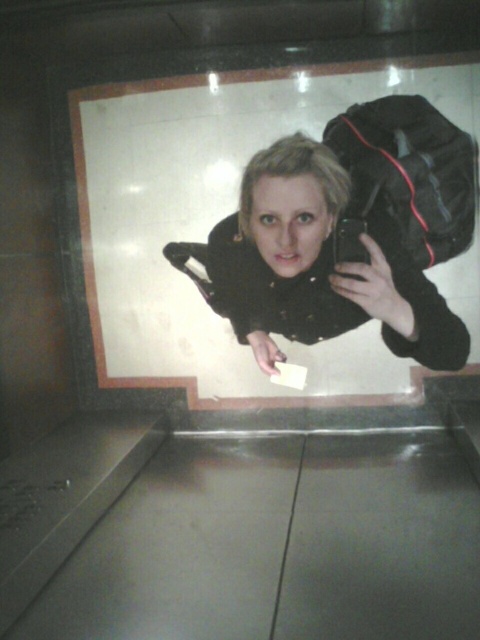
Question: Among these points, which one is nearest to the camera?

Choices:
 (A) (465, 140)
 (B) (446, 362)

Answer: (B)

Question: Does matte black jacket at center appear over black fabric bag at upper right?

Choices:
 (A) yes
 (B) no

Answer: (B)

Question: Which point appears closest to the camera in this image?

Choices:
 (A) (260, 150)
 (B) (410, 196)

Answer: (A)

Question: Is matte black jacket at center above black fabric bag at upper right?

Choices:
 (A) yes
 (B) no

Answer: (B)

Question: Is matte black jacket at center above black fabric bag at upper right?

Choices:
 (A) yes
 (B) no

Answer: (B)